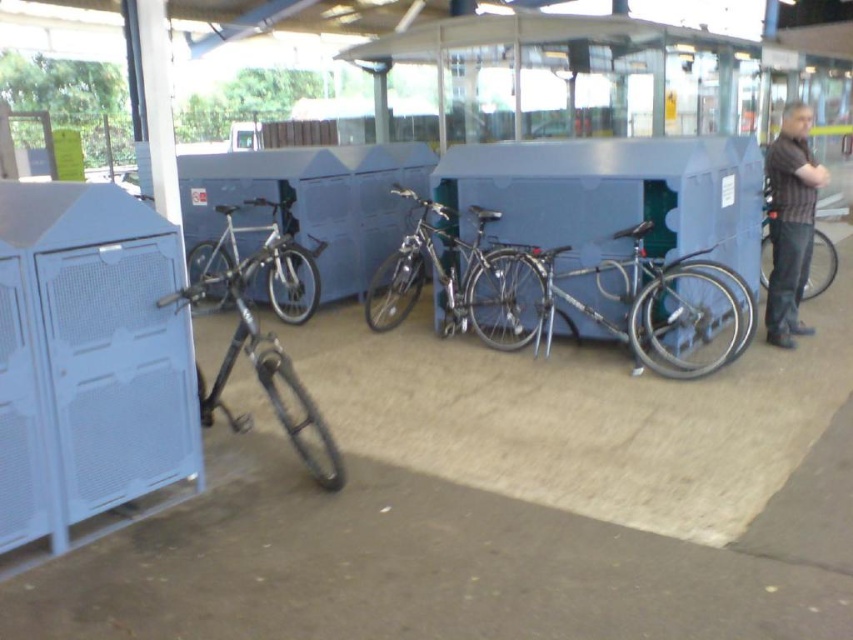
You are a cyclist who wants to park your shiny metallic bicycle at center and shiny metallic bicycle at left. Which bicycle should you move to make space for the other?

The shiny metallic bicycle at center is on the right side of the shiny metallic bicycle at left. To make space, you should move the shiny metallic bicycle at left to the left, allowing the shiny metallic bicycle at center to shift right.

You are a delivery person who needs to choose a bicycle to load packages onto. The shiny silver bicycle at center and the matte black bicycle at right are available. Which bicycle should you choose if you want one that is taller to make loading easier?

You should choose the shiny silver bicycle at center because it is taller than the matte black bicycle at right, making it easier to load packages.

You are a delivery person who needs to choose between the shiny silver bicycle at center and the matte black bicycle at right. Which bicycle is larger in size?

The shiny silver bicycle at center is bigger than the matte black bicycle at right, so choose the shiny silver bicycle at center.